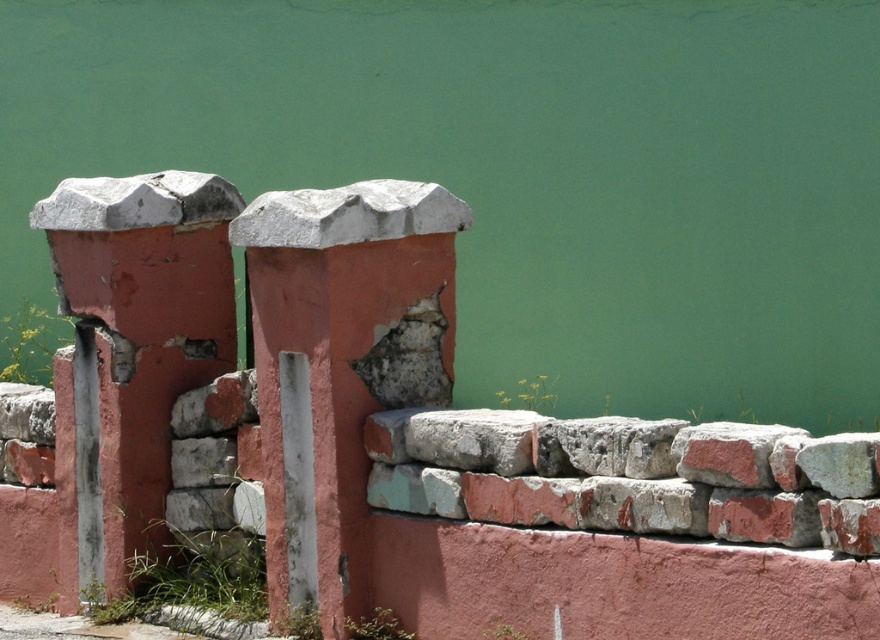
Is rusty concrete pillar at center wider than rusty concrete pillar at left?

Correct, the width of rusty concrete pillar at center exceeds that of rusty concrete pillar at left.

Between rusty concrete pillar at center and rusty concrete pillar at left, which one has more height?

With more height is rusty concrete pillar at left.

Does point (262, 196) come behind point (158, 173)?

No, (262, 196) is in front of (158, 173).

Identify the location of rusty concrete pillar at center. Image resolution: width=880 pixels, height=640 pixels. (341, 364).

In the scene shown: Is rusty concrete pillar at center smaller than rusty stone brick at lower right?

No.

How far apart are rusty concrete pillar at center and rusty stone brick at lower right?

4.94 feet

Does point (255, 314) come in front of point (675, 452)?

No, it is behind (675, 452).

This screenshot has height=640, width=880. Find the location of `rusty concrete pillar at center`. rusty concrete pillar at center is located at coordinates (341, 364).

Is rusty stone brick at lower right wider than rusty brick stone at center?

Correct, the width of rusty stone brick at lower right exceeds that of rusty brick stone at center.

Between rusty stone brick at lower right and rusty brick stone at center, which one is positioned higher?

rusty brick stone at center is above.

Does point (766, 429) come behind point (170, 417)?

That is False.

I want to click on rusty stone brick at lower right, so click(728, 452).